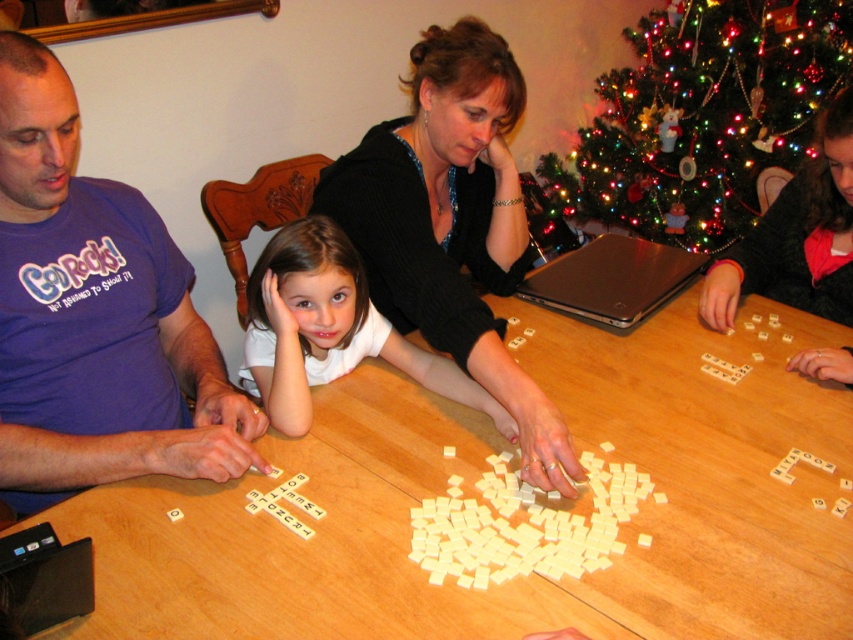
Is white plastic tiles at center to the left of white plastic letter tiles at center from the viewer's perspective?

No, white plastic tiles at center is not to the left of white plastic letter tiles at center.

Between white plastic tiles at center and white plastic letter tiles at center, which one is positioned lower?

white plastic tiles at center

Who is more forward, (490, 490) or (317, 506)?

Point (317, 506)

Find the location of a particular element. This screenshot has width=853, height=640. white plastic tiles at center is located at coordinates (524, 525).

Who is more forward, (483,163) or (264,356)?

Point (264,356)

Is point (538, 416) farther from camera compared to point (299, 266)?

No, it is not.

This screenshot has width=853, height=640. I want to click on black sweater at center, so click(x=451, y=225).

Can you confirm if purple t-shirt at left is smaller than white matte/soft child at center?

Incorrect, purple t-shirt at left is not smaller in size than white matte/soft child at center.

Can you confirm if purple t-shirt at left is positioned above white matte/soft child at center?

Yes.

Locate an element on the screen. purple t-shirt at left is located at coordinates [96, 316].